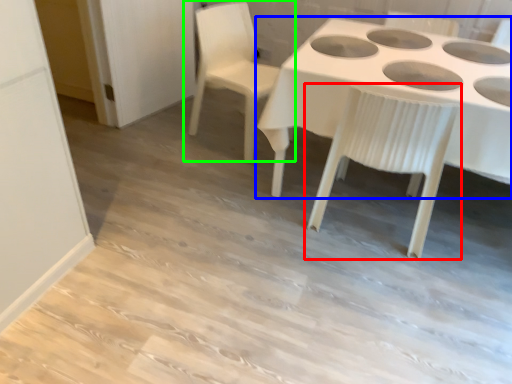
Question: Considering the real-world distances, which object is closest to chair (highlighted by a red box)? table (highlighted by a blue box) or chair (highlighted by a green box).

Choices:
 (A) table
 (B) chair

Answer: (A)